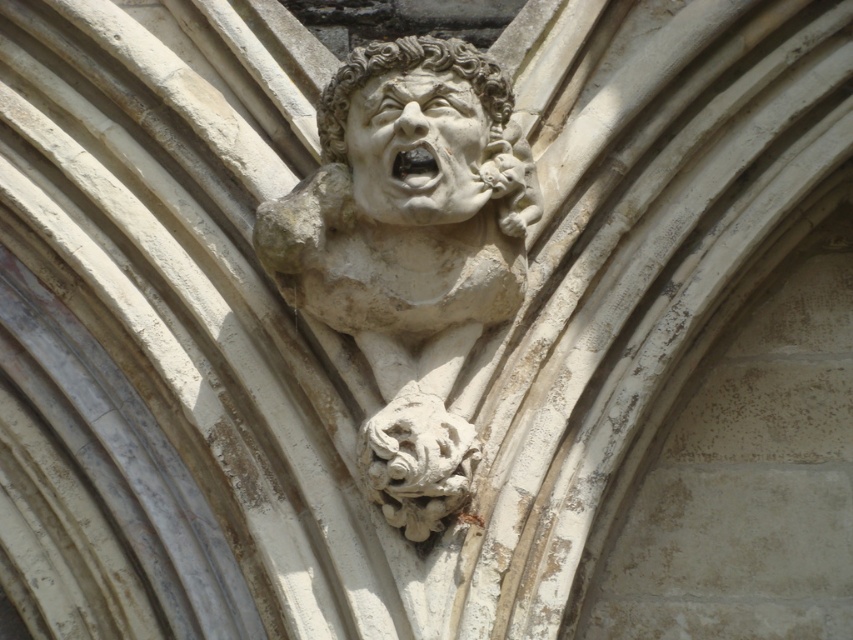
You are an architect examining the stone details of a historical building. You notice the white stone gargoyle at center and the smooth stone face at upper center. Which object is closer to you?

The white stone gargoyle at center is closer to you as it is positioned in front of the smooth stone face at upper center.

You are an architect inspecting a historical building. You notice the white stone gargoyle at center and the smooth stone face at upper center. Which of these two elements is taller?

The white stone gargoyle at center is taller than the smooth stone face at upper center.